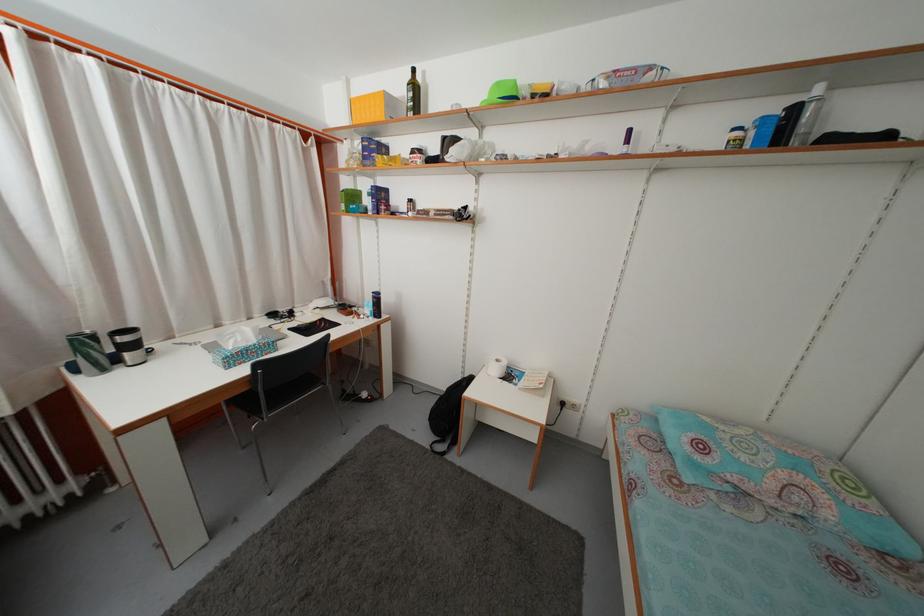
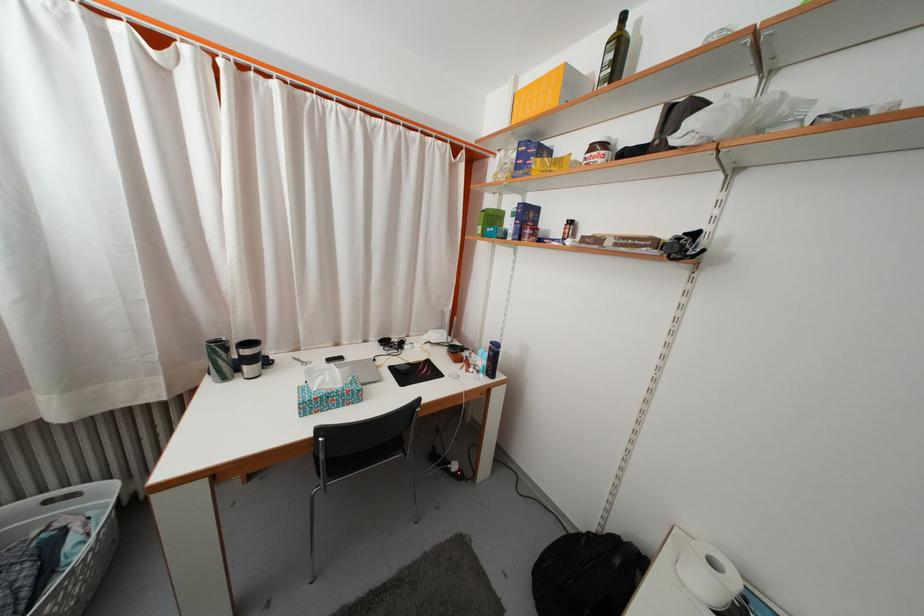
Find the pixel in the second image that matches (359,204) in the first image.

(500, 225)